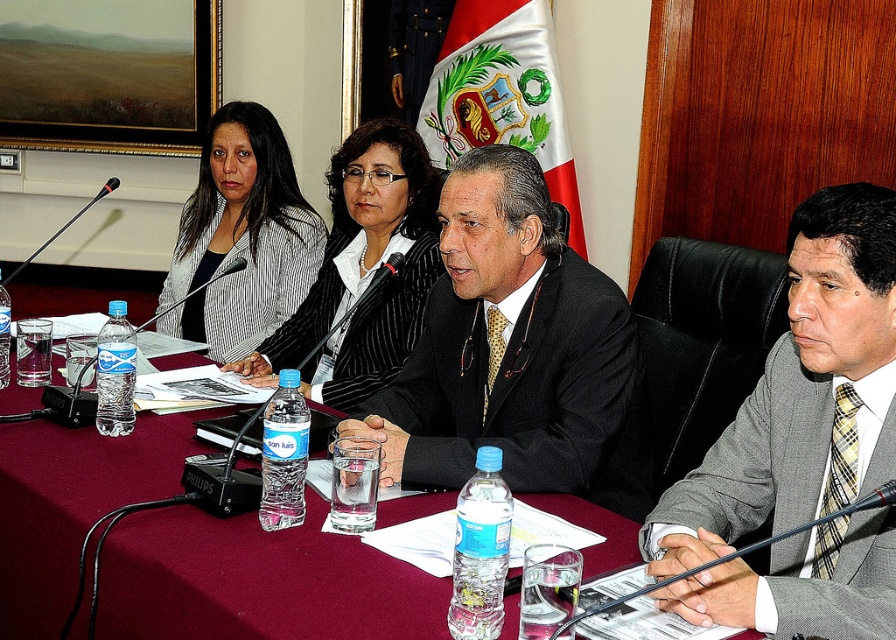
Looking at this image, in the formal meeting scene, where is the gray textured suit at center located in terms of its 2D coordinates?

The gray textured suit at center is located at the 2D coordinates of point (802,392).

You are attending a conference and need to locate the gray textured suit at center. Based on the coordinates provided in the scene description, where exactly is the gray textured suit positioned?

The gray textured suit at center is located at point 0.614 on the x axis and 0.896 on the y axis.